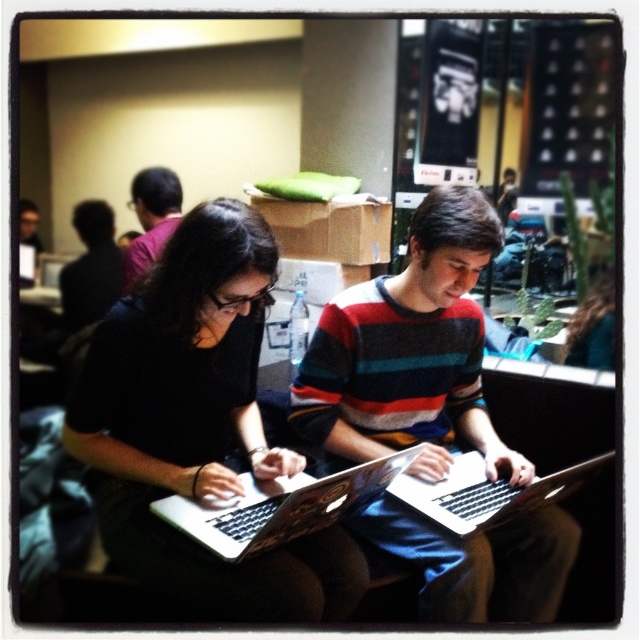
Who is shorter, striped knit sweater at center or matte black shirt at upper left?

With less height is matte black shirt at upper left.

Who is more forward, (356, 365) or (173, 230)?

Point (356, 365)

Identify the location of striped knit sweater at center. (410, 353).

Does black matte laptop at center appear on the left side of matte black laptop at left?

No, black matte laptop at center is not to the left of matte black laptop at left.

The width and height of the screenshot is (640, 640). Describe the element at coordinates (198, 426) in the screenshot. I see `black matte laptop at center` at that location.

Is point (262, 556) more distant than point (35, 212)?

No.

The image size is (640, 640). Identify the location of black matte laptop at center. (198, 426).

Is metallic silver laptop at center bigger than silver metallic laptop at center?

Yes.

Which of these two, metallic silver laptop at center or silver metallic laptop at center, stands taller?

metallic silver laptop at center

Who is more distant from viewer, (257, 499) or (477, 515)?

Point (477, 515)

At what (x,y) coordinates should I click in order to perform the action: click on metallic silver laptop at center. Please return your answer as a coordinate pair (x, y). Looking at the image, I should click on (276, 506).